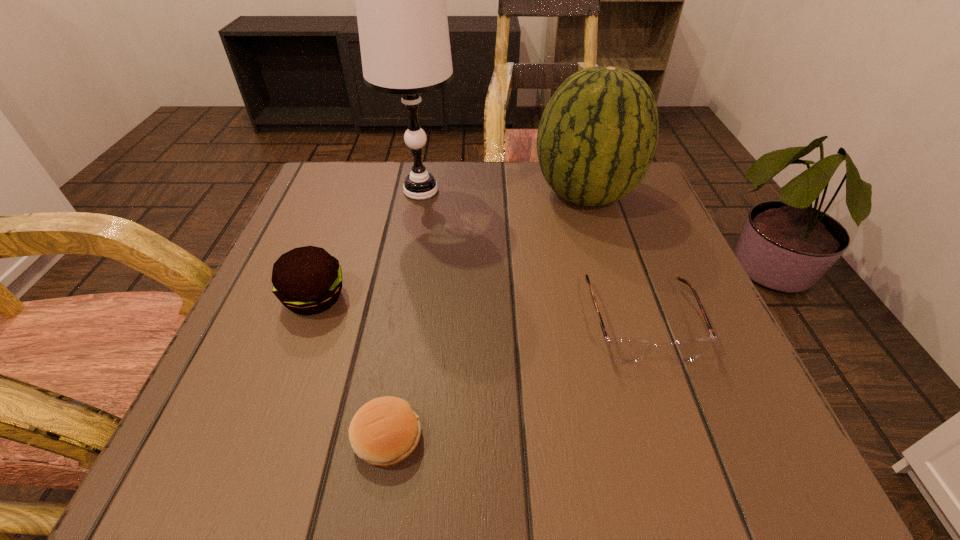
The width and height of the screenshot is (960, 540). What are the coordinates of `vacant space that is in between the nearer patty and the table lamp` in the screenshot? It's located at (404, 314).

At what (x,y) coordinates should I click in order to perform the action: click on free spot between the nearer patty and the watermelon. Please return your answer as a coordinate pair (x, y). This screenshot has height=540, width=960. Looking at the image, I should click on (486, 316).

Where is `empty space that is in between the left patty and the table lamp`? empty space that is in between the left patty and the table lamp is located at coordinates (368, 245).

Identify the location of vacant space in between the spectacles and the leftmost object. The image size is (960, 540). (477, 310).

Image resolution: width=960 pixels, height=540 pixels. Find the location of `unoccupied area between the fourth shortest object and the table lamp`. unoccupied area between the fourth shortest object and the table lamp is located at coordinates (503, 193).

Locate an element on the screen. This screenshot has width=960, height=540. unoccupied position between the tallest object and the watermelon is located at coordinates (503, 193).

Identify which object is located as the third nearest to the table lamp. Please provide its 2D coordinates. Your answer should be formatted as a tuple, i.e. [(x, y)], where the tuple contains the x and y coordinates of a point satisfying the conditions above.

[(625, 349)]

Identify which object is the third closest to the second tallest object. Please provide its 2D coordinates. Your answer should be formatted as a tuple, i.e. [(x, y)], where the tuple contains the x and y coordinates of a point satisfying the conditions above.

[(307, 280)]

You are a GUI agent. You are given a task and a screenshot of the screen. Output one action in this format:
    pyautogui.click(x=<x>, y=<y>)
    Task: Click on the free location that satisfies the following two spatial constraints: 1. on the back side of the fourth shortest object; 2. on the left side of the left patty
    
    Given the screenshot: What is the action you would take?
    pyautogui.click(x=352, y=195)